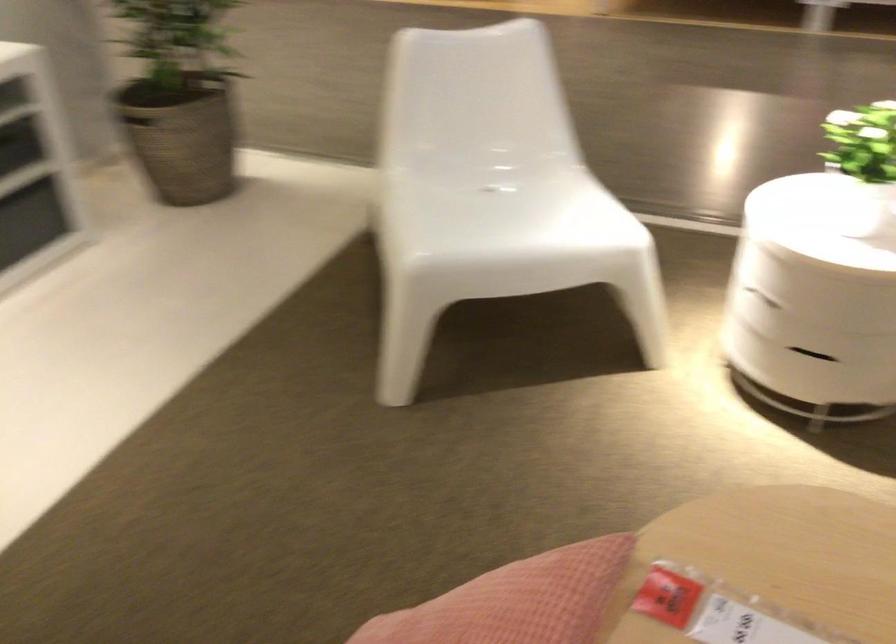
Find where to sit the chair sitting surface. Please return your answer as a coordinate pair (x, y).

(485, 218)